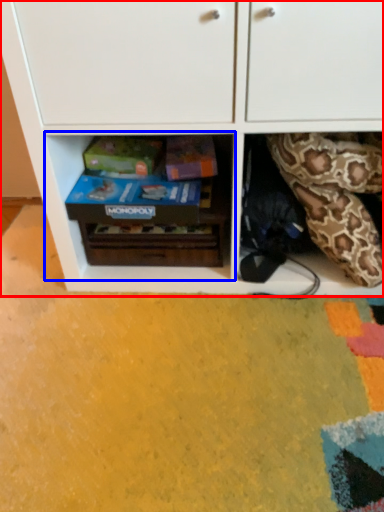
Question: Among these objects, which one is farthest to the camera, cabinetry (highlighted by a red box) or shelf (highlighted by a blue box)?

Choices:
 (A) cabinetry
 (B) shelf

Answer: (B)